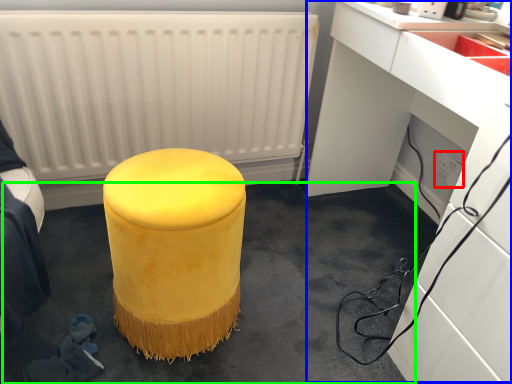
Question: Considering the real-world distances, which object is farthest from electric outlet (highlighted by a red box)? computer desk (highlighted by a blue box) or concrete (highlighted by a green box)?

Choices:
 (A) computer desk
 (B) concrete

Answer: (B)